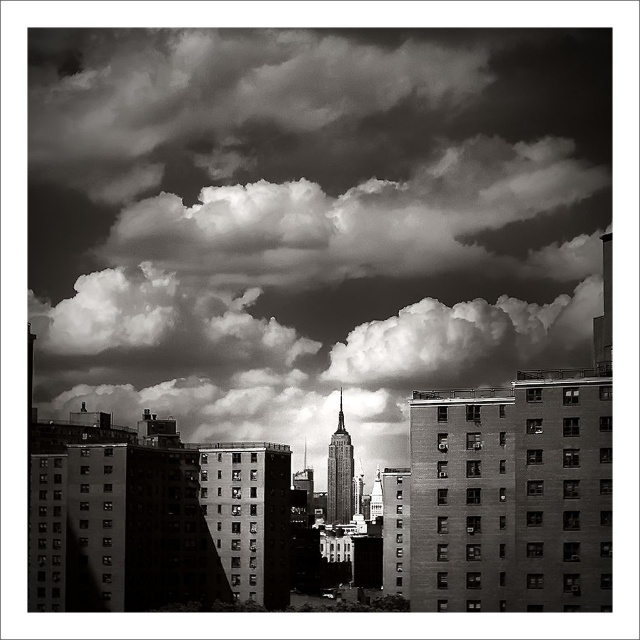
Can you confirm if cloudy sky at upper center is positioned to the right of smooth glass skyscraper at center?

Incorrect, cloudy sky at upper center is not on the right side of smooth glass skyscraper at center.

Does cloudy sky at upper center have a greater height compared to smooth glass skyscraper at center?

Yes.

Which is behind, point (388, 144) or point (326, 508)?

The point (388, 144) is behind.

Find the location of a particular element. This screenshot has height=640, width=640. cloudy sky at upper center is located at coordinates (308, 216).